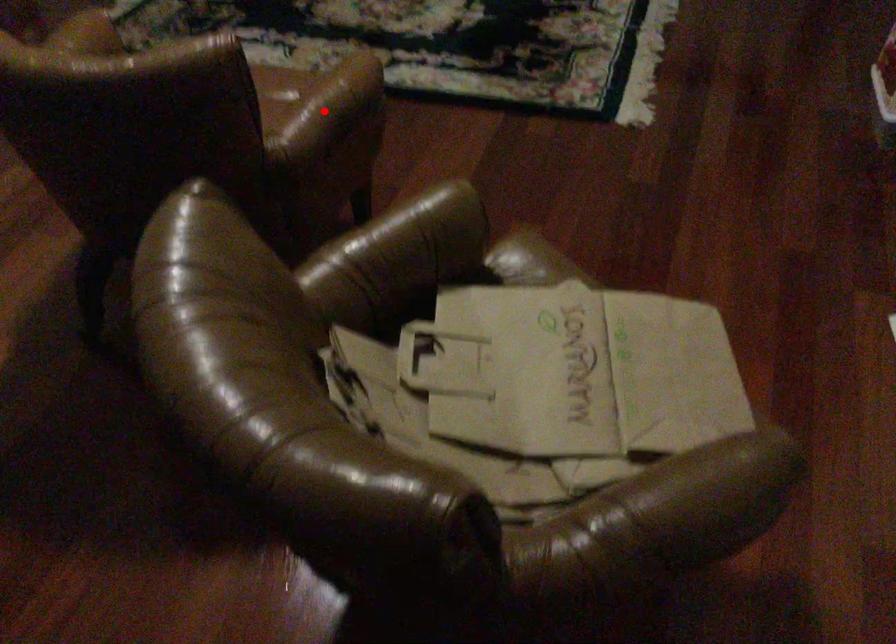
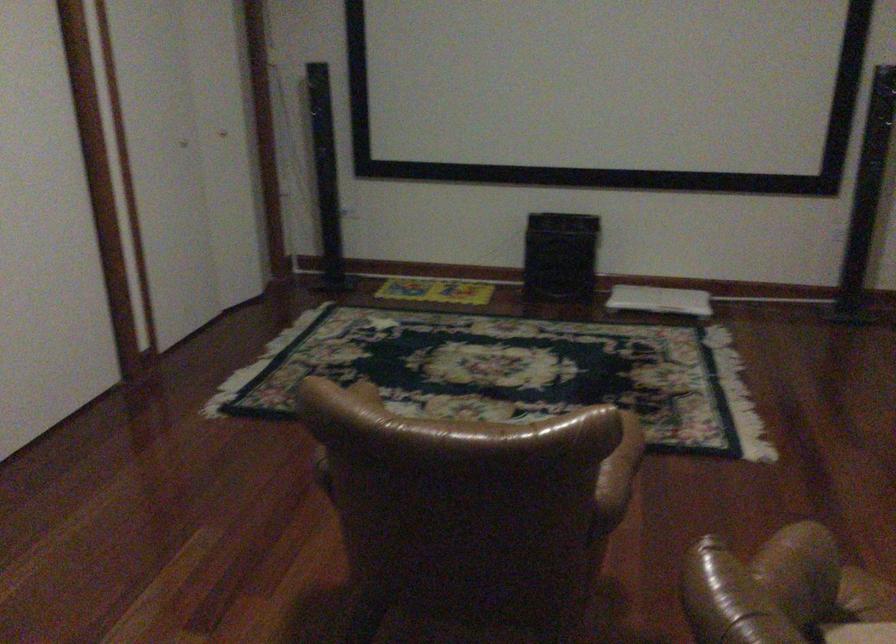
Question: I am providing you with two images of the same scene from different viewpoints. In image1, a red point is highlighted. Considering the same 3D point in image2, which of the following is correct?

Choices:
 (A) It is closer
 (B) It is farther

Answer: (B)